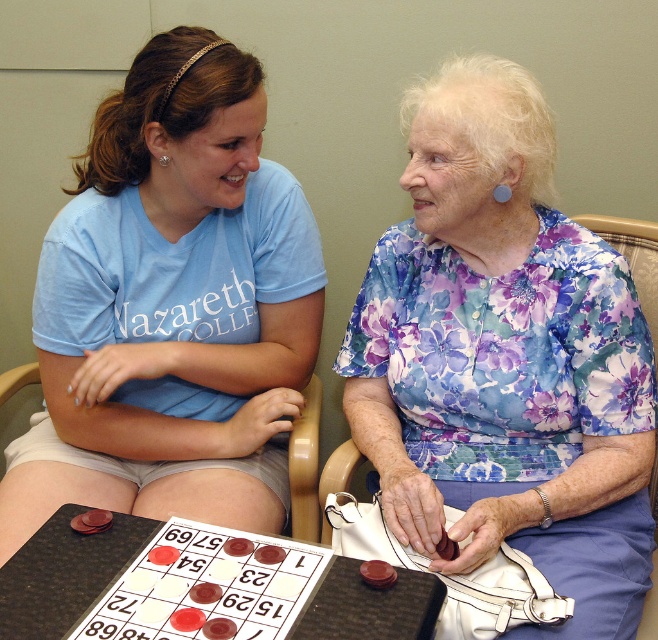
From the picture: You are a visitor at the community center and want to sit at the table where the game is being played. Which object, the translucent plastic board at center or the wooden chair at center, should you move to get a better view of the game?

The wooden chair at center should be moved because the translucent plastic board at center is below it, so moving the chair would allow you to see the board better.

You are a photographer standing in front of the scene. You want to capture a photo that includes both the floral fabric blouse at upper right and the wooden chair at center. However, your camera has a limited field of view. Which object should you position closer to the camera to ensure both are fully visible in the frame?

Since the floral fabric blouse at upper right is larger in size than the wooden chair at center, you should position the floral fabric blouse at upper right closer to the camera to ensure both objects fit within the frame. This way, the larger blouse will take up more space, while the smaller chair can be placed slightly further back but still remain visible.